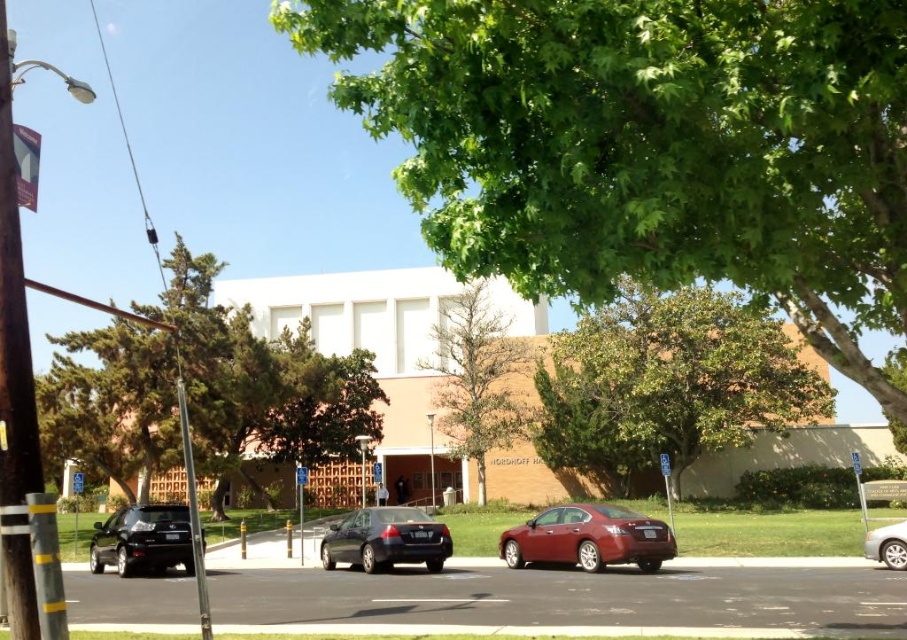
Question: Is green leafy tree at center smaller than shiny black sedan at lower left?

Choices:
 (A) no
 (B) yes

Answer: (A)

Question: Which object is farther from the camera taking this photo?

Choices:
 (A) shiny black sedan at center
 (B) green leafy tree at upper center
 (C) silver metallic sedan at lower right
 (D) shiny red sedan at center

Answer: (A)

Question: Among these points, which one is nearest to the camera?

Choices:
 (A) (114, 536)
 (B) (483, 381)
 (C) (704, 362)
 (D) (896, 525)

Answer: (D)

Question: Which point is closer to the camera?

Choices:
 (A) green leafy tree at center
 (B) brown textured tree at center
 (C) silver metallic sedan at lower right

Answer: (A)

Question: Observing the image, what is the correct spatial positioning of green leafy tree at upper center in reference to green leafy tree at center?

Choices:
 (A) right
 (B) left

Answer: (A)

Question: Is shiny black sedan at center smaller than shiny black sedan at lower left?

Choices:
 (A) no
 (B) yes

Answer: (A)